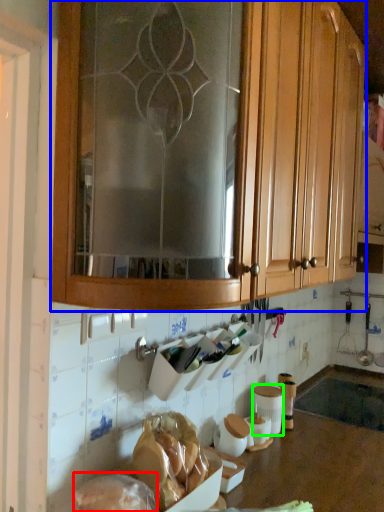
Question: Which object is positioned farthest from food (highlighted by a red box)? Select from cabinetry (highlighted by a blue box) and pottery (highlighted by a green box).

Choices:
 (A) cabinetry
 (B) pottery

Answer: (A)